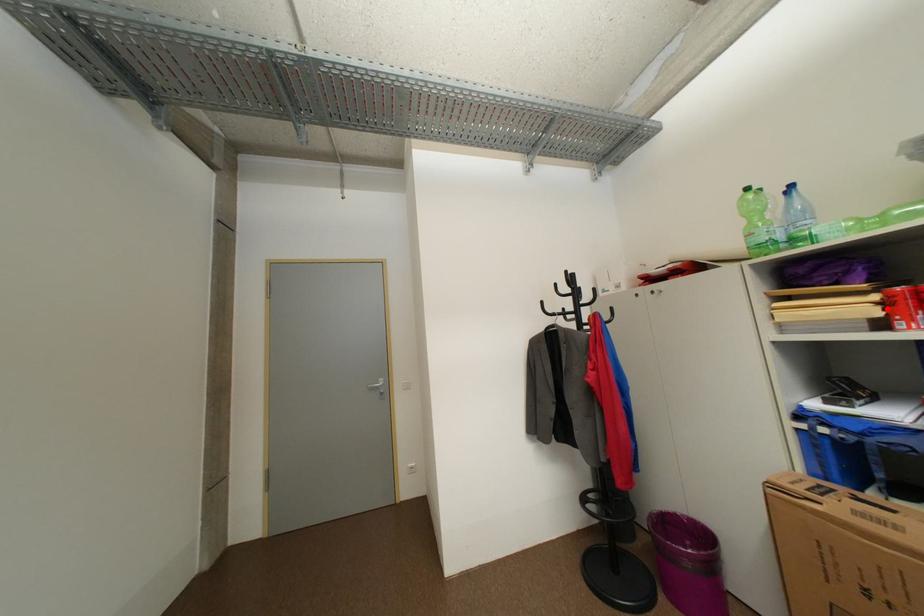
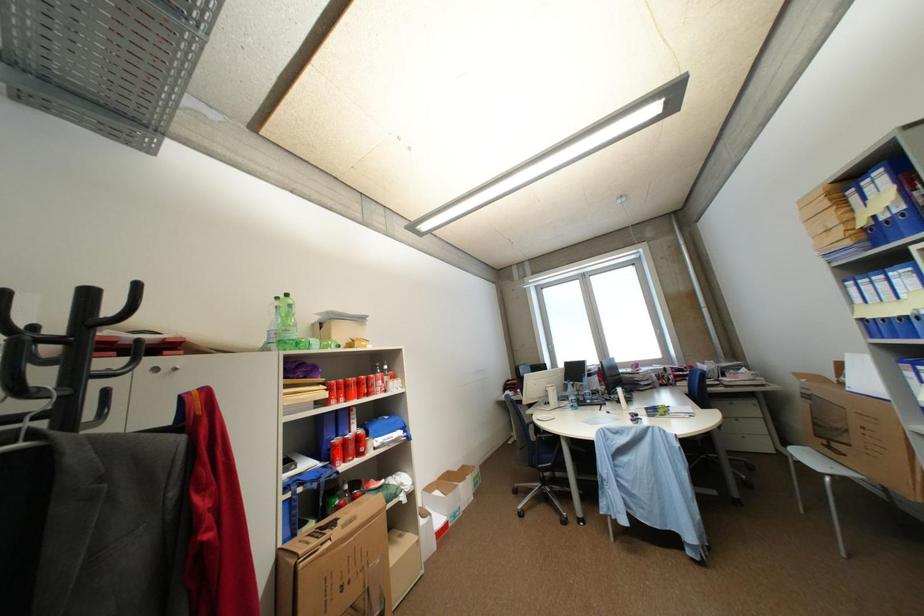
I am providing you with two images of the same scene from different viewpoints. A red point is marked on the first image and another point is marked on the second image. Do the highlighted points in image1 and image2 indicate the same real-world spot?

No